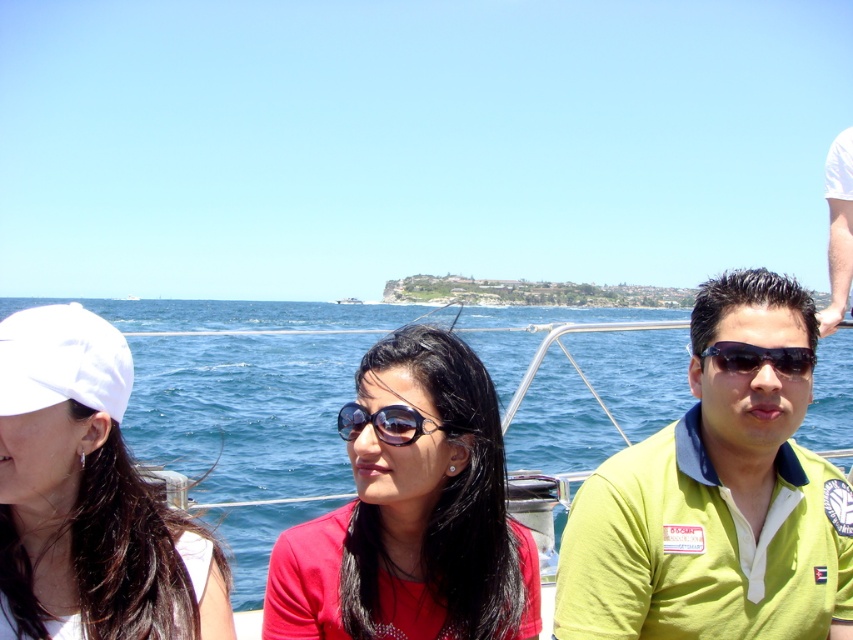
You are a photographer trying to capture a clear shot of the black plastic sunglasses at center and the white fabric arm at upper right. Which object should you focus on first to ensure it appears sharp in your photo?

You should focus on the white fabric arm at upper right first because it is closer to you than the black plastic sunglasses at center, so it requires proper focus to appear sharp.

You are planning to take a photo of the green polo shirt at right and the black plastic sunglasses at center. Which object should you focus on first if you want to capture both in the same frame without zooming in or out?

You should focus on the green polo shirt at right first because it is larger than the black plastic sunglasses at center, allowing both to fit in the frame without needing to adjust the zoom.